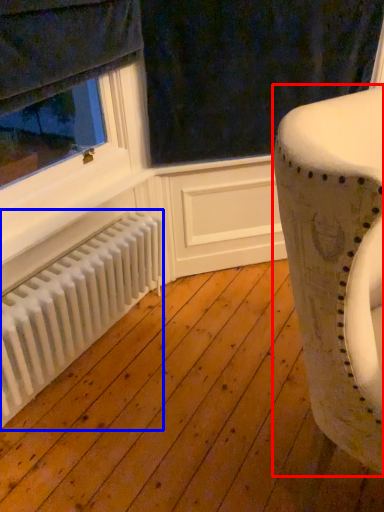
Question: Which of the following is the closest to the observer, furniture (highlighted by a red box) or radiator (highlighted by a blue box)?

Choices:
 (A) furniture
 (B) radiator

Answer: (A)